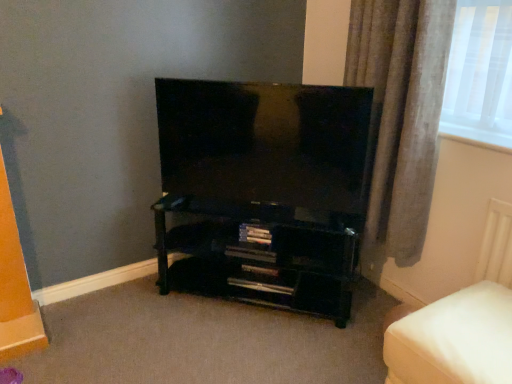
Image resolution: width=512 pixels, height=384 pixels. What are the coordinates of `free space that is to the left of black glossy shelf at lower center` in the screenshot? It's located at point(129,317).